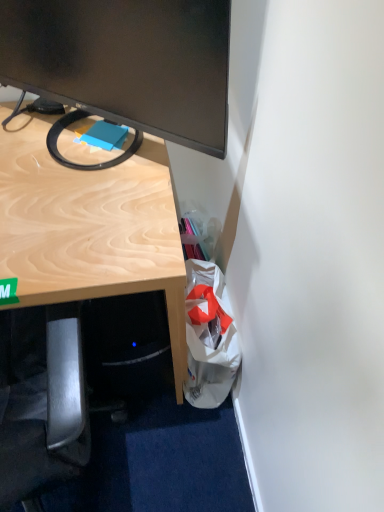
What are the coordinates of `empty space that is ontop of white fabric bag at lower right` in the screenshot? It's located at (206, 325).